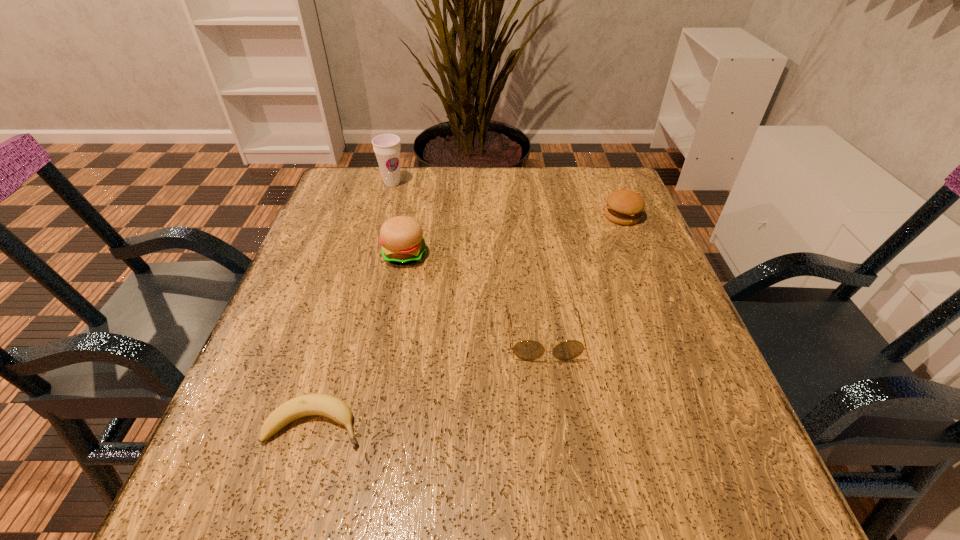
The image size is (960, 540). Find the location of `free space between the sunglasses and the shorter hamburger`. free space between the sunglasses and the shorter hamburger is located at coordinates (583, 276).

Identify the location of vacant space that's between the farthest object and the right hamburger. (508, 199).

At what (x,y) coordinates should I click in order to perform the action: click on free space between the nearer hamburger and the fourth object from left to right. Please return your answer as a coordinate pair (x, y). The width and height of the screenshot is (960, 540). Looking at the image, I should click on (474, 295).

At what (x,y) coordinates should I click in order to perform the action: click on free space between the cup and the nearest object. Please return your answer as a coordinate pair (x, y). The image size is (960, 540). Looking at the image, I should click on (354, 304).

Where is `free space that is in between the taller hamburger and the shortest object`? free space that is in between the taller hamburger and the shortest object is located at coordinates (360, 340).

Identify the location of vacant area that lies between the left hamburger and the sunglasses. The height and width of the screenshot is (540, 960). (474, 295).

Choose which object is the second nearest neighbor to the nearest object. Please provide its 2D coordinates. Your answer should be formatted as a tuple, i.e. [(x, y)], where the tuple contains the x and y coordinates of a point satisfying the conditions above.

[(401, 237)]

The width and height of the screenshot is (960, 540). What are the coordinates of `object that ranks as the third closest to the fourth nearest object` in the screenshot? It's located at (387, 147).

Where is `free spot that satisfies the following two spatial constraints: 1. on the front side of the farther hamburger; 2. on the right side of the farthest object`? Image resolution: width=960 pixels, height=540 pixels. free spot that satisfies the following two spatial constraints: 1. on the front side of the farther hamburger; 2. on the right side of the farthest object is located at coordinates (384, 216).

Identify the location of free space that satisfies the following two spatial constraints: 1. on the lenses of the sunglasses; 2. at the stem of the banana. The width and height of the screenshot is (960, 540). (556, 425).